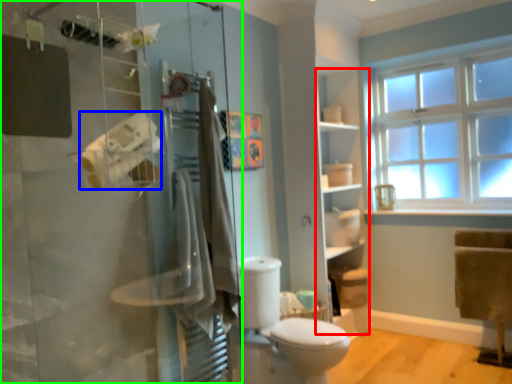
Question: Which is nearer to the shelf (highlighted by a red box)? toilet paper (highlighted by a blue box) or shower door (highlighted by a green box).

Choices:
 (A) toilet paper
 (B) shower door

Answer: (B)